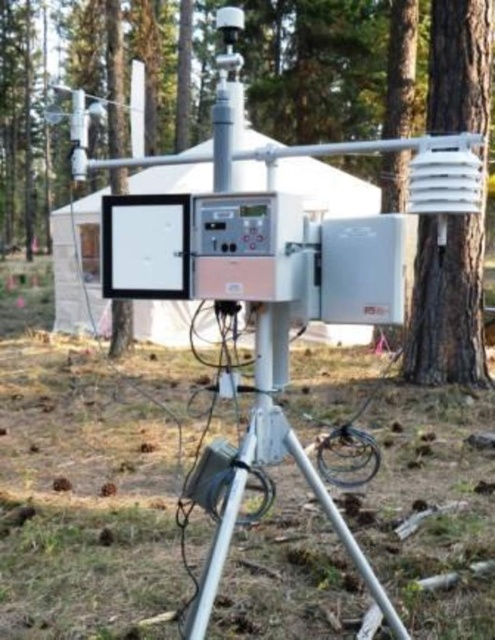
Can you confirm if matte white tree at center is thinner than white plastic tent at center?

Incorrect, matte white tree at center's width is not less than white plastic tent at center's.

Between matte white tree at center and white plastic tent at center, which one has less height?

white plastic tent at center is shorter.

The image size is (495, 640). Describe the element at coordinates (313, 67) in the screenshot. I see `matte white tree at center` at that location.

You are a GUI agent. You are given a task and a screenshot of the screen. Output one action in this format:
    pyautogui.click(x=<x>, y=<y>)
    Task: Click on the matte white tree at center
    The image size is (495, 640).
    Given the screenshot: What is the action you would take?
    pyautogui.click(x=313, y=67)

Looking at this image, does white plastic sensor at right appear on the right side of white plastic tent at center?

Correct, you'll find white plastic sensor at right to the right of white plastic tent at center.

Measure the distance between white plastic sensor at right and camera.

A distance of 23.32 feet exists between white plastic sensor at right and camera.

This screenshot has width=495, height=640. What are the coordinates of `white plastic sensor at right` in the screenshot? It's located at (446, 305).

Does white plastic sensor at right have a greater width compared to silver metallic tripod at lower center?

In fact, white plastic sensor at right might be narrower than silver metallic tripod at lower center.

Who is higher up, white plastic sensor at right or silver metallic tripod at lower center?

Positioned higher is white plastic sensor at right.

Is point (457, 372) behind point (324, 499)?

Yes, point (457, 372) is behind point (324, 499).

Locate an element on the screen. The image size is (495, 640). white plastic sensor at right is located at coordinates (446, 305).